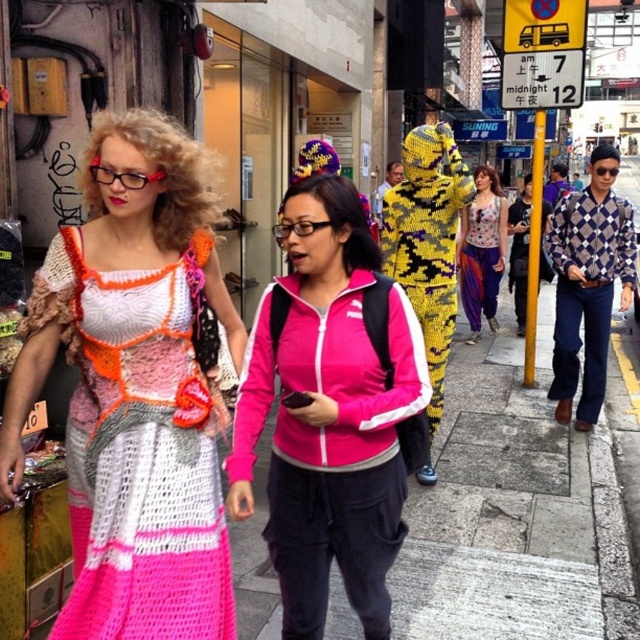
Question: Can you confirm if crochet fabric dress at left is smaller than pink fabric dress at center?

Choices:
 (A) yes
 (B) no

Answer: (A)

Question: Which is farther from the pink fabric jacket at center?

Choices:
 (A) printed fabric dress at center
 (B) pink fabric dress at center
 (C) gray concrete pavement at center

Answer: (A)

Question: Is gray concrete pavement at center smaller than blue checkered sweater at right?

Choices:
 (A) yes
 (B) no

Answer: (B)

Question: Estimate the real-world distances between objects in this image. Which object is closer to the pink fabric jacket at center?

Choices:
 (A) blue checkered sweater at right
 (B) crochet fabric dress at left

Answer: (B)

Question: Does pink fabric jacket at center have a larger size compared to pink fabric dress at center?

Choices:
 (A) no
 (B) yes

Answer: (A)

Question: Estimate the real-world distances between objects in this image. Which object is farther from the printed fabric dress at center?

Choices:
 (A) pink fabric jacket at center
 (B) gray concrete pavement at center

Answer: (A)